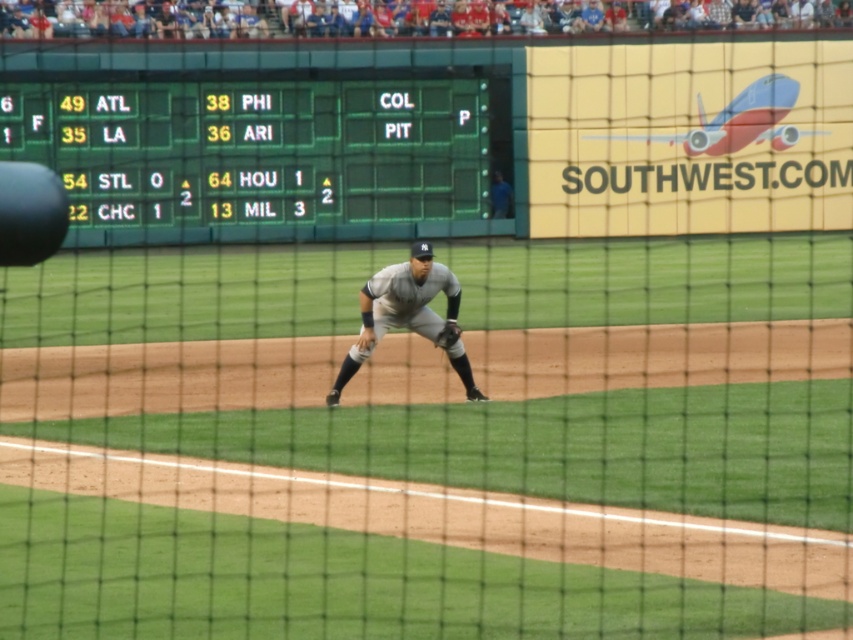
You are a photographer trying to capture a photo of both the green plastic scoreboard at upper left and the dark brown leather glove at center. Since the scoreboard is much taller than the glove, will you need to adjust your camera angle to include both in the frame?

The green plastic scoreboard at upper left is much taller than the dark brown leather glove at center, so you will need to adjust your camera angle to include both in the frame.

You are a spectator sitting in the first row of the stadium, and you want to throw a small paper airplane to hit the green plastic scoreboard at upper left. Considering your position, do you think the distance is manageable for a paper airplane?

The green plastic scoreboard at upper left is 123.77 feet away from viewer. Since paper airplanes typically have a limited range of about 30 to 60 feet, the distance is too far for a paper airplane to reach.

You are a stadium designer reviewing the stadium layout. You notice two points marked on the blueprint at coordinates point(416, 128) and point(450, 337). From the perspective of someone standing at the center of the field, which point is located behind the other?

Point(416, 128) is behind point(450, 337) from the perspective of someone standing at the center of the field.